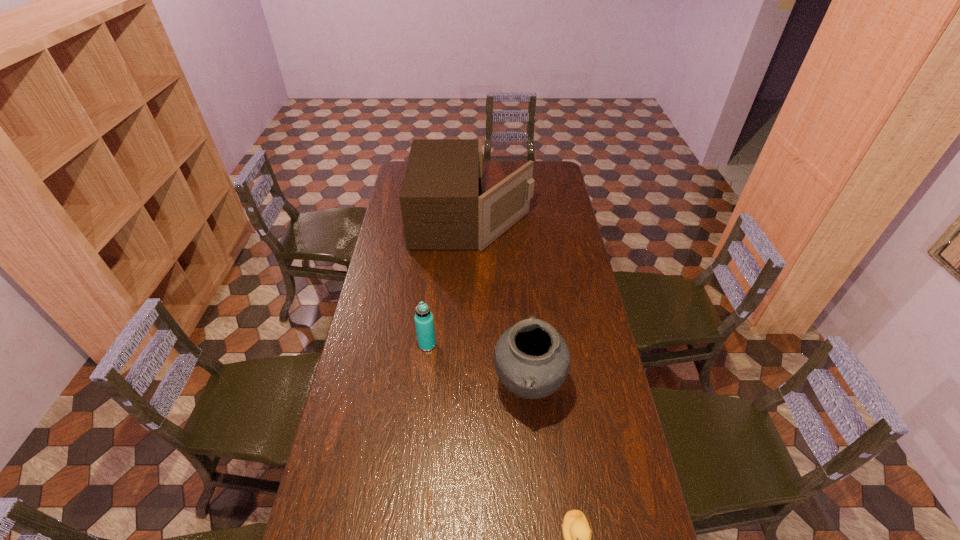
At what (x,y) coordinates should I click in order to perform the action: click on free region at the right edge of the desktop. Please return your answer as a coordinate pair (x, y). Image resolution: width=960 pixels, height=540 pixels. Looking at the image, I should click on (606, 484).

In the image, there is a desktop. Where is `free region at the far left corner`? free region at the far left corner is located at coordinates (402, 176).

The image size is (960, 540). Find the location of `free space at the far right corner of the desktop`. free space at the far right corner of the desktop is located at coordinates (558, 161).

Identify the location of free spot between the farthest object and the second nearest object. (500, 302).

Locate an element on the screen. free space that is in between the urn and the third nearest object is located at coordinates (478, 366).

Image resolution: width=960 pixels, height=540 pixels. Find the location of `free space between the microwave oven and the water bottle`. free space between the microwave oven and the water bottle is located at coordinates (450, 282).

Find the location of a particular element. The width and height of the screenshot is (960, 540). empty space that is in between the third nearest object and the third farthest object is located at coordinates (478, 366).

Locate which object ranks second in proximity to the urn. Please provide its 2D coordinates. Your answer should be formatted as a tuple, i.e. [(x, y)], where the tuple contains the x and y coordinates of a point satisfying the conditions above.

[(577, 534)]

Locate an element on the screen. This screenshot has width=960, height=540. object that can be found as the third closest to the farthest object is located at coordinates (577, 534).

At what (x,y) coordinates should I click in order to perform the action: click on vacant region that satisfies the following two spatial constraints: 1. with the door open on the front of the farthest object; 2. on the right side of the third farthest object. Please return your answer as a coordinate pair (x, y). The image size is (960, 540). Looking at the image, I should click on (469, 387).